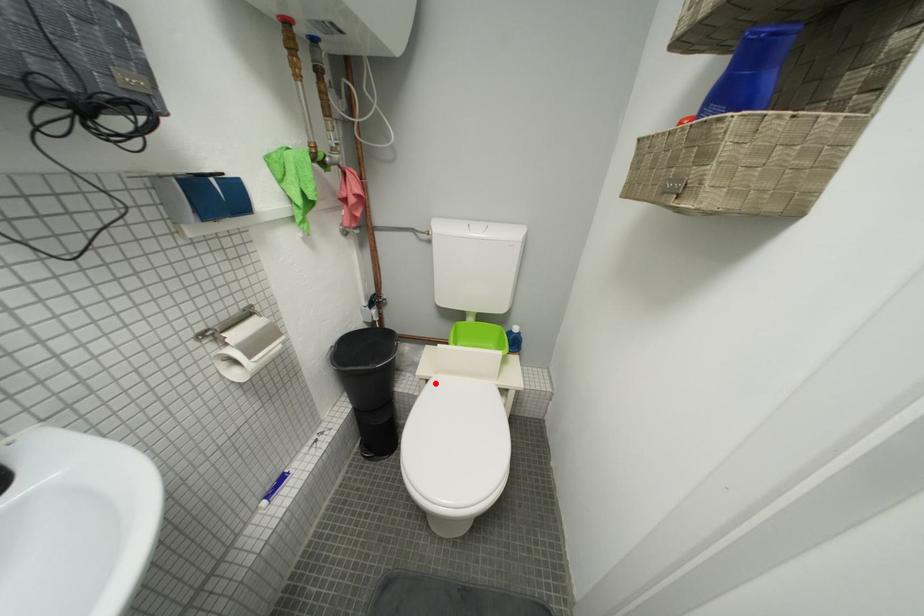
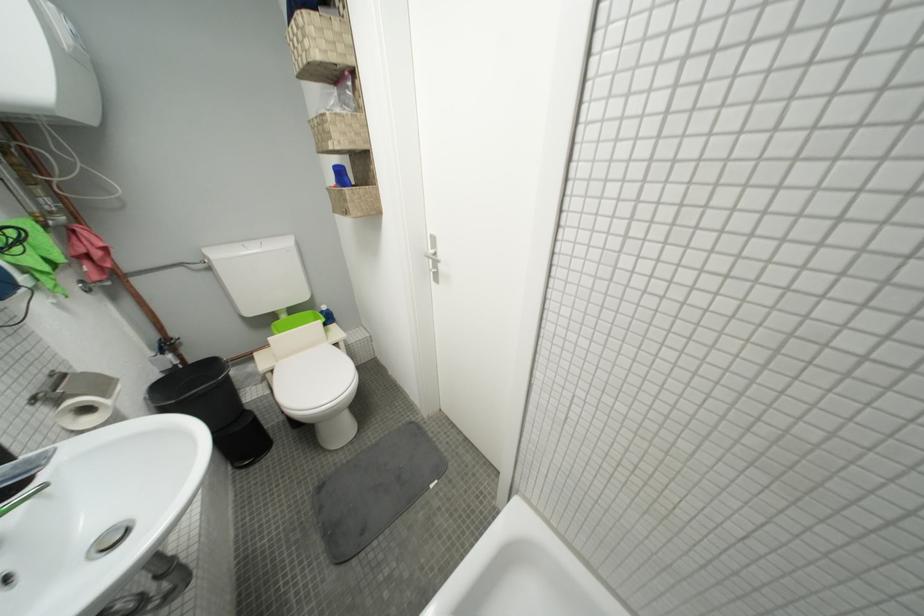
In the second image, find the point that corresponds to the highlighted location in the first image.

(281, 373)